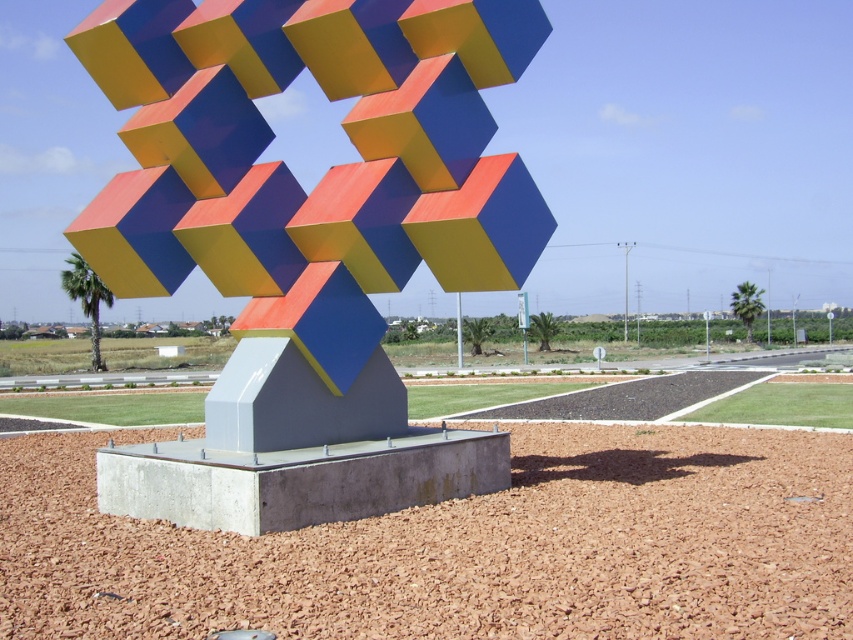
Is matte painted cube at center further to the viewer compared to smooth concrete base at center?

Yes, matte painted cube at center is further from the viewer.

Is point (421, 12) positioned behind point (555, 508)?

That is True.

Identify the location of matte painted cube at center. (308, 236).